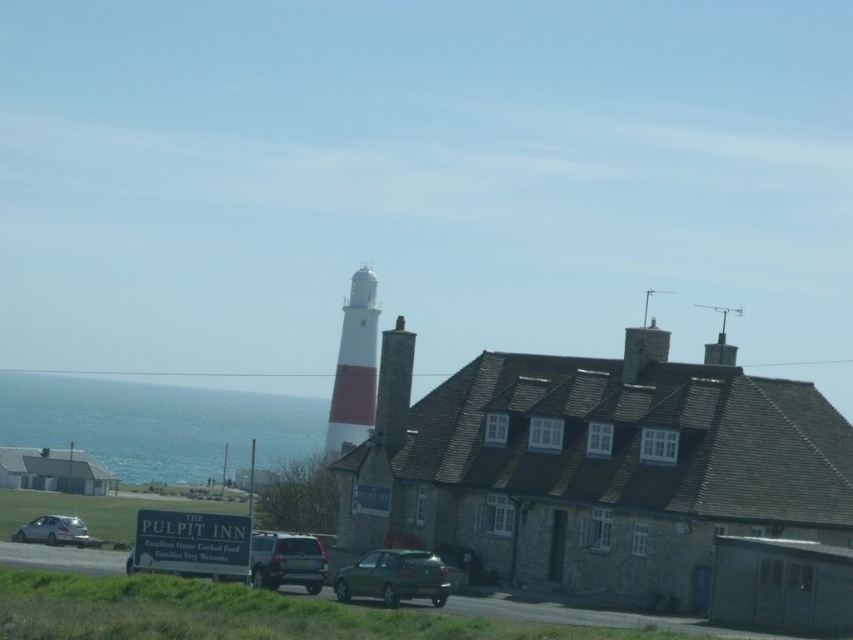
Does green matte hatchback at center appear under silver metallic car at lower left?

Incorrect, green matte hatchback at center is not positioned below silver metallic car at lower left.

Is green matte hatchback at center to the left of silver metallic car at lower left from the viewer's perspective?

In fact, green matte hatchback at center is to the right of silver metallic car at lower left.

The image size is (853, 640). Describe the element at coordinates (393, 577) in the screenshot. I see `green matte hatchback at center` at that location.

You are a GUI agent. You are given a task and a screenshot of the screen. Output one action in this format:
    pyautogui.click(x=<x>, y=<y>)
    Task: Click on the green matte hatchback at center
    
    Given the screenshot: What is the action you would take?
    pyautogui.click(x=393, y=577)

Can you confirm if white painted stone tower at center is taller than green matte hatchback at center?

Yes, white painted stone tower at center is taller than green matte hatchback at center.

Can you confirm if white painted stone tower at center is positioned below green matte hatchback at center?

Incorrect, white painted stone tower at center is not positioned below green matte hatchback at center.

Locate an element on the screen. Image resolution: width=853 pixels, height=640 pixels. white painted stone tower at center is located at coordinates (354, 365).

From the picture: Which of these two, green matte hatchback at center or satin silver suv at center, stands taller?

satin silver suv at center

Is point (361, 579) positioned behind point (252, 576)?

No, (361, 579) is closer to viewer.

Identify the location of green matte hatchback at center. click(x=393, y=577).